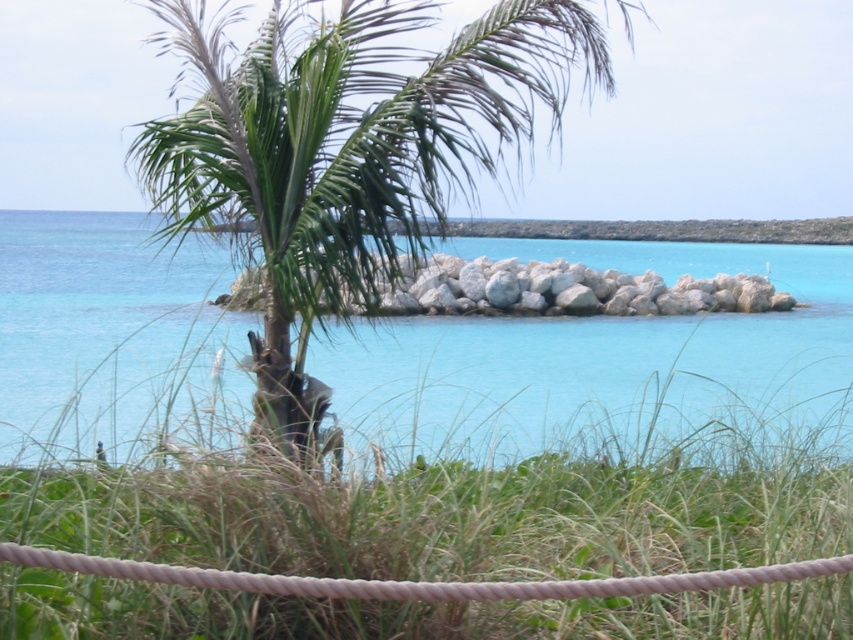
Question: Is turquoise water at center further to camera compared to white rock at center?

Choices:
 (A) yes
 (B) no

Answer: (B)

Question: Observing the image, what is the correct spatial positioning of turquoise water at center in reference to green leafy palm tree at center?

Choices:
 (A) above
 (B) below

Answer: (B)

Question: Which object appears farthest from the camera in this image?

Choices:
 (A) turquoise water at center
 (B) green grass at center
 (C) white rock at center

Answer: (C)

Question: Among these objects, which one is farthest from the camera?

Choices:
 (A) turquoise water at center
 (B) green leafy palm tree at center
 (C) white rock at center
 (D) green grass at center

Answer: (C)

Question: Which object is the closest to the green leafy palm tree at center?

Choices:
 (A) white rock at center
 (B) green grass at center
 (C) turquoise water at center

Answer: (B)

Question: Does turquoise water at center appear on the left side of white rock at center?

Choices:
 (A) no
 (B) yes

Answer: (B)